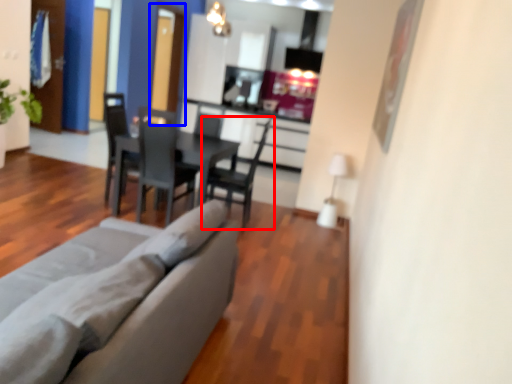
Question: Which point is further to the camera, chair (highlighted by a red box) or glass door (highlighted by a blue box)?

Choices:
 (A) chair
 (B) glass door

Answer: (B)